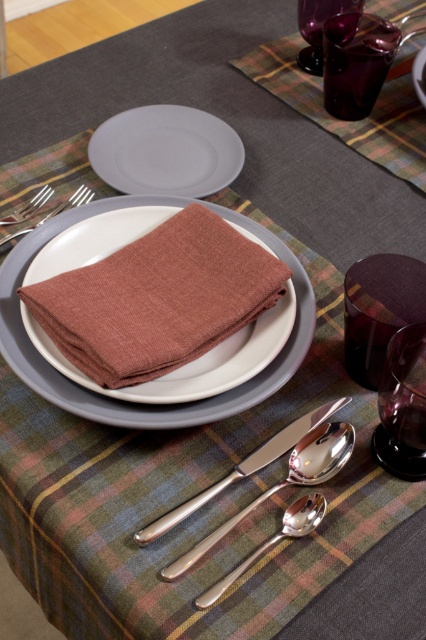
You are a server at a restaurant and need to place a 16.5 inch long dessert fork between the satin silver spoon at lower center and the silver metallic fork at upper left. Can you fit it there without overlapping either of them?

The distance between the satin silver spoon at lower center and the silver metallic fork at upper left is 16.61 inches. Since the dessert fork is 16.5 inches long, there is enough space to place it between them without overlapping either object.

You are a server arranging the dining table. You need to place a new decorative item between the transparent purple wine glass at upper right and the matte silver fork at left. Which object should you place it closer to so it appears closer to the viewer?

The transparent purple wine glass at upper right is closer to the viewer than the matte silver fork at left. Therefore, placing the decorative item closer to the transparent purple wine glass at upper right will make it appear closer to the viewer.

You are a guest at a formal dinner and need to use the silver metallic spoon at center. Where should you place your hand to reach it without moving the matte gray plate at center?

The silver metallic spoon at center is in front of the matte gray plate at center, so you can reach it by placing your hand in front of the matte gray plate at center without disturbing it.